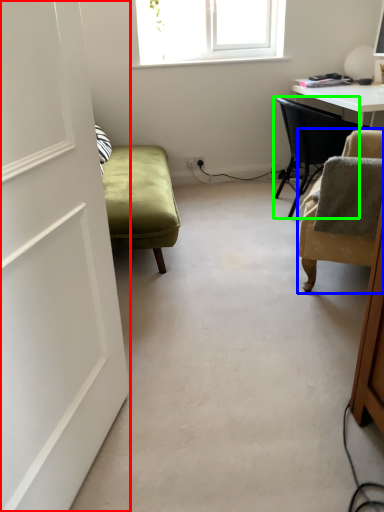
Question: Considering the real-world distances, which object is closest to door (highlighted by a red box)? chair (highlighted by a blue box) or chair (highlighted by a green box).

Choices:
 (A) chair
 (B) chair

Answer: (A)